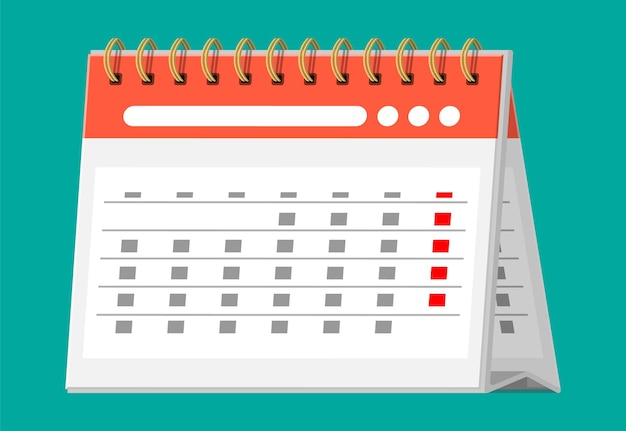
Where is `boxes on the second row from the top`? boxes on the second row from the top is located at coordinates (289, 217), (339, 216), (390, 218), (443, 218).